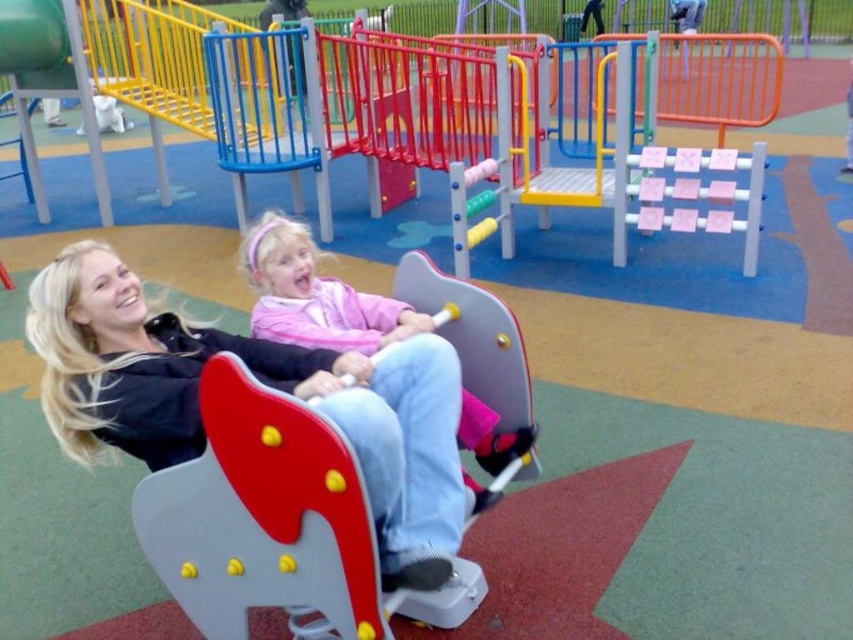
Who is more forward, (80, 273) or (492, 444)?

Point (80, 273) is in front.

Who is higher up, matte black jacket at center or pink matte shirt at center?

pink matte shirt at center

Between point (111, 252) and point (485, 422), which one is positioned behind?

Positioned behind is point (485, 422).

Locate an element on the screen. matte black jacket at center is located at coordinates (260, 381).